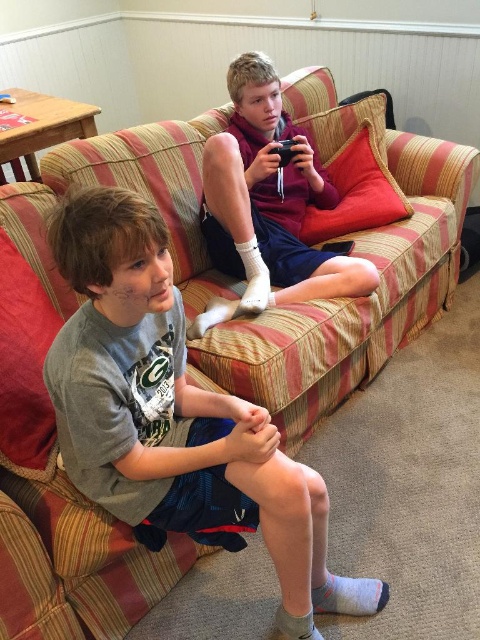
Does matte purple hoodie at upper center have a lesser width compared to gray/soft cotton sock at lower center?

No.

Which is behind, point (267, 163) or point (379, 600)?

Point (267, 163)

Where is `matte purple hoodie at upper center`? matte purple hoodie at upper center is located at coordinates (266, 204).

Is white soft sock at center behind gray cotton sock at lower center?

That is True.

Does white soft sock at center lie in front of gray cotton sock at lower center?

No, it is not.

I want to click on white soft sock at center, so click(253, 276).

The image size is (480, 640). What do you see at coordinates (349, 595) in the screenshot?
I see `gray/soft cotton sock at lower center` at bounding box center [349, 595].

Is gray/soft cotton sock at lower center smaller than white soft sock at center?

Correct, gray/soft cotton sock at lower center occupies less space than white soft sock at center.

Which is in front, point (347, 584) or point (262, 272)?

Positioned in front is point (347, 584).

Locate an element on the screen. gray/soft cotton sock at lower center is located at coordinates (349, 595).